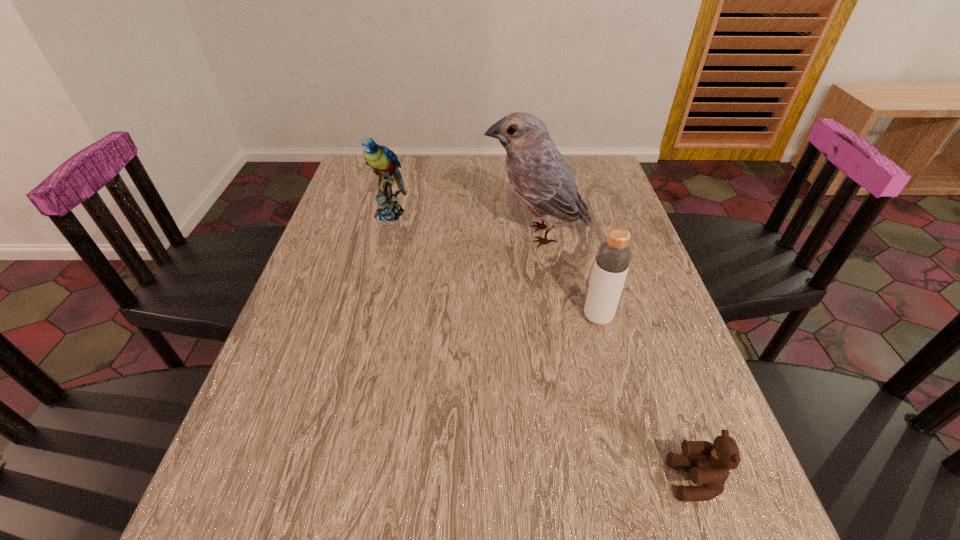
Locate an element on the screen. The width and height of the screenshot is (960, 540). free space that satisfies the following two spatial constraints: 1. on the face of the bottle; 2. on the left side of the left parrot is located at coordinates (363, 317).

Image resolution: width=960 pixels, height=540 pixels. Identify the location of free space that satisfies the following two spatial constraints: 1. on the face of the second nearest object; 2. on the right side of the left parrot. (363, 317).

This screenshot has height=540, width=960. I want to click on vacant space that satisfies the following two spatial constraints: 1. on the face of the left parrot; 2. on the left side of the bottle, so click(x=363, y=317).